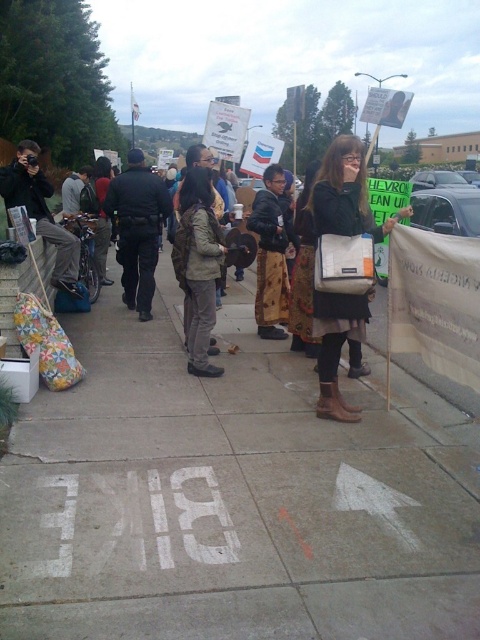
Question: Which object appears closest to the camera in this image?

Choices:
 (A) khaki fabric pants at center
 (B) brown leather boots at center
 (C) white concrete sidewalk at center
 (D) dark brown leather jacket at center

Answer: (C)

Question: Is brown leather boots at center positioned behind khaki fabric pants at center?

Choices:
 (A) no
 (B) yes

Answer: (A)

Question: Which of the following is the closest to the observer?

Choices:
 (A) brown leather boots at center
 (B) khaki fabric pants at center
 (C) dark brown leather jacket at center
 (D) white concrete sidewalk at center

Answer: (D)

Question: Is white concrete sidewalk at center smaller than dark brown leather jacket at center?

Choices:
 (A) no
 (B) yes

Answer: (A)

Question: Which point appears farthest from the camera in this image?

Choices:
 (A) (327, 301)
 (B) (203, 212)

Answer: (B)

Question: Considering the relative positions of dark brown leather jacket at center and khaki fabric pants at center in the image provided, where is dark brown leather jacket at center located with respect to khaki fabric pants at center?

Choices:
 (A) below
 (B) above

Answer: (B)